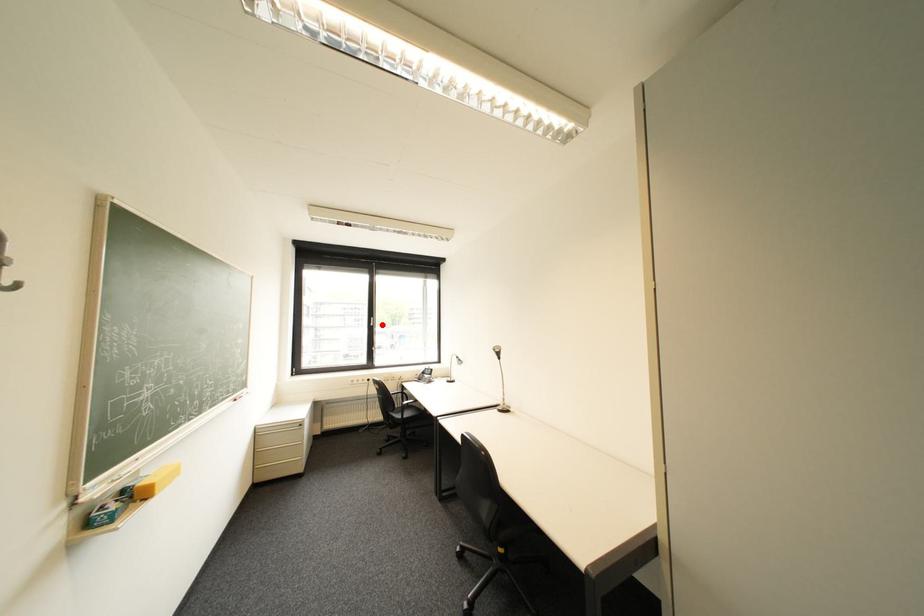
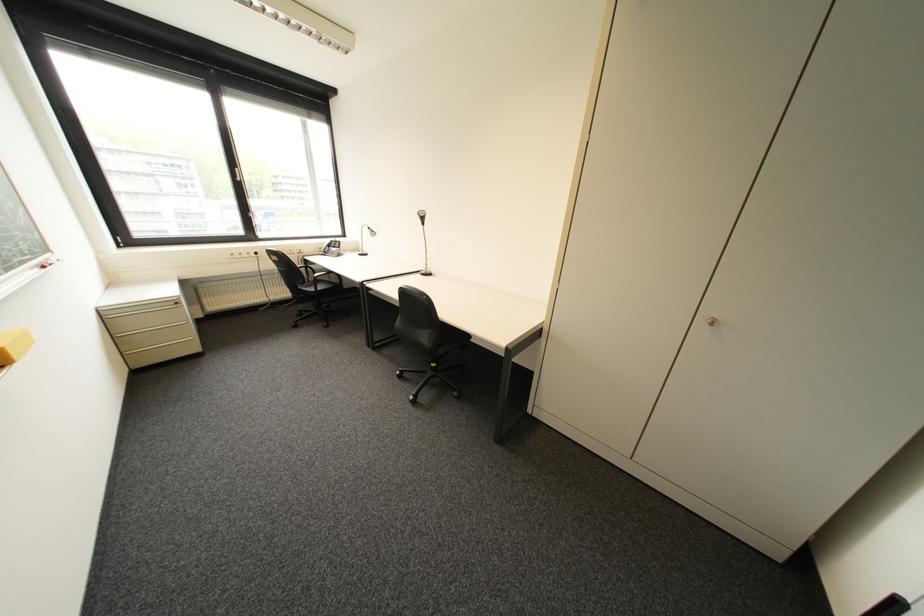
Where in the second image is the point corresponding to the highlighted location from the first image?

(249, 180)